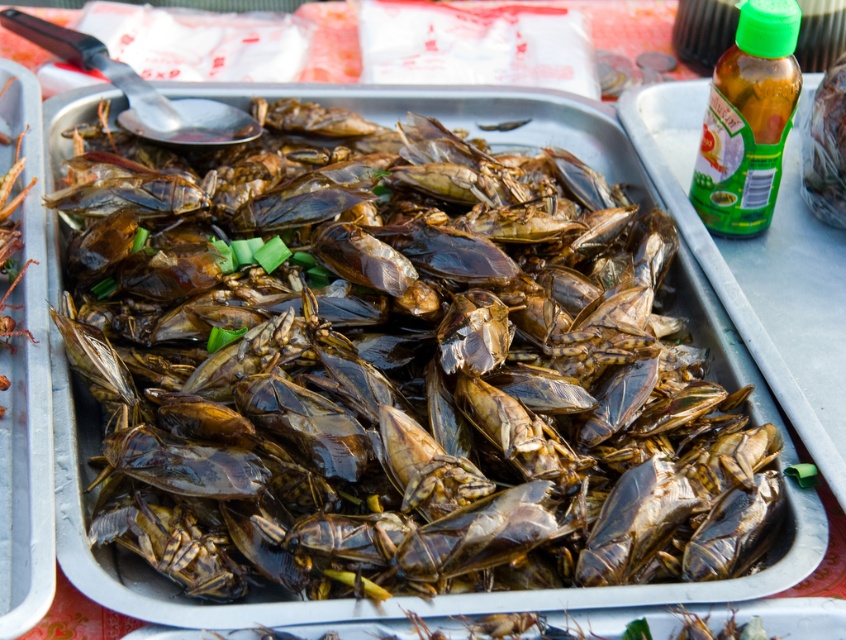
You are a food vendor preparing a dish and need to place both the shiny brown insects at center and the green plastic bottle at upper right on a customer tray. Given that the bottle must be placed near the edge to avoid spills, can the bottle fit on the tray without overlapping the insects?

The shiny brown insects at center are larger than the green plastic bottle at upper right. Since the bottle is smaller, it can be placed near the edge of the tray without overlapping the insects.

You are at a food stall and want to grab the green plastic bottle at upper right to pour sauce over the shiny brown insects at center. Can you reach the bottle without moving the tray?

The shiny brown insects at center is positioned on the left side of green plastic bottle at upper right, so the bottle is to the right of the insects. Since the tray is in the center, you can reach the bottle on the right side without moving the tray.